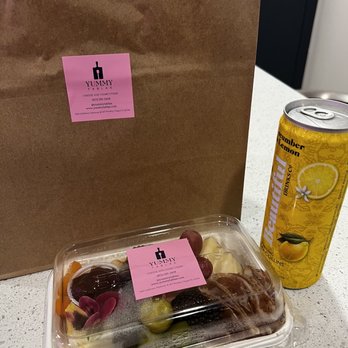
Identify the location of countertop. (318, 318), (16, 307).